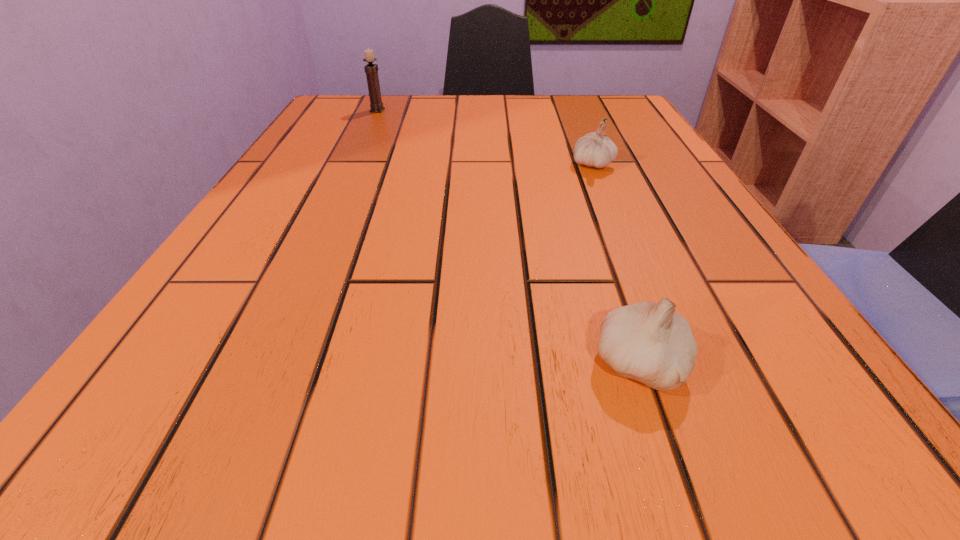
The image size is (960, 540). Find the location of `object present at the far left corner`. object present at the far left corner is located at coordinates [x=371, y=70].

This screenshot has width=960, height=540. What are the coordinates of `object that is at the near right corner` in the screenshot? It's located at (651, 343).

The width and height of the screenshot is (960, 540). In the image, there is a desktop. In order to click on vacant space at the far edge in this screenshot , I will do `click(515, 105)`.

Image resolution: width=960 pixels, height=540 pixels. In the image, there is a desktop. Find the location of `vacant space at the near edge`. vacant space at the near edge is located at coordinates (430, 394).

In the image, there is a desktop. Where is `free space at the left edge`? This screenshot has height=540, width=960. free space at the left edge is located at coordinates (297, 173).

Locate an element on the screen. This screenshot has height=540, width=960. vacant space at the right edge is located at coordinates (682, 258).

The width and height of the screenshot is (960, 540). I want to click on free space at the far left corner of the desktop, so tap(345, 110).

You are a GUI agent. You are given a task and a screenshot of the screen. Output one action in this format:
    pyautogui.click(x=<x>, y=<y>)
    Task: Click on the vacant area at the near left corner of the desktop
    This screenshot has width=960, height=540.
    Given the screenshot: What is the action you would take?
    pyautogui.click(x=183, y=437)

Identify the location of blank area at the far right corner. The height and width of the screenshot is (540, 960). (590, 129).

This screenshot has height=540, width=960. I want to click on blank space at the near right corner of the desktop, so click(x=852, y=423).